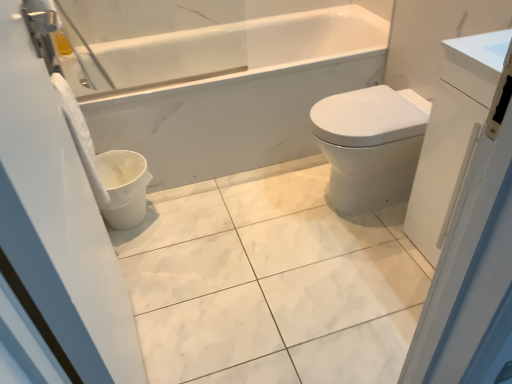
You are a GUI agent. You are given a task and a screenshot of the screen. Output one action in this format:
    pyautogui.click(x=<x>, y=<y>)
    Task: Click on the free spot to the right of white glossy screen door at left, which ranks as the first screen door in left-to-right order
    
    Given the screenshot: What is the action you would take?
    pyautogui.click(x=247, y=334)